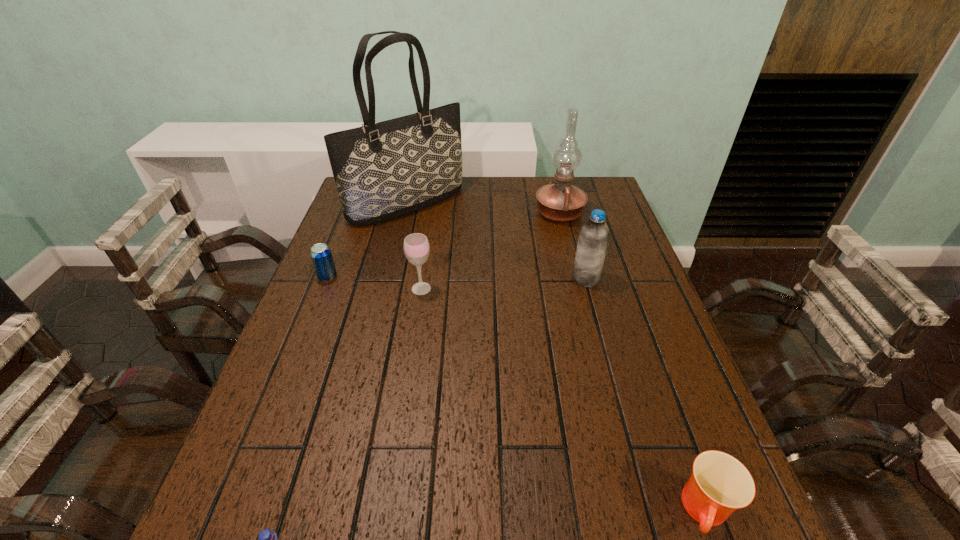
Where is `the tallest object`? This screenshot has height=540, width=960. the tallest object is located at coordinates (383, 170).

Identify the location of oil lamp. (561, 202).

Where is `the third tallest object`? the third tallest object is located at coordinates (593, 239).

Find the location of `the fourth shortest object`. the fourth shortest object is located at coordinates coord(416,246).

Locate an element on the screen. Image resolution: width=960 pixels, height=540 pixels. beer can is located at coordinates (321, 255).

Where is `free location located on the right of the tote bag`? Image resolution: width=960 pixels, height=540 pixels. free location located on the right of the tote bag is located at coordinates (573, 204).

Locate an element on the screen. This screenshot has width=960, height=540. vacant area located 0.090m on the back of the oil lamp is located at coordinates (553, 186).

Image resolution: width=960 pixels, height=540 pixels. I want to click on vacant space located on the front of the fifth shortest object, so click(623, 417).

Image resolution: width=960 pixels, height=540 pixels. I want to click on free space located 0.180m on the back of the wineglass, so click(428, 242).

Image resolution: width=960 pixels, height=540 pixels. I want to click on vacant region located 0.140m on the right of the beer can, so click(x=388, y=277).